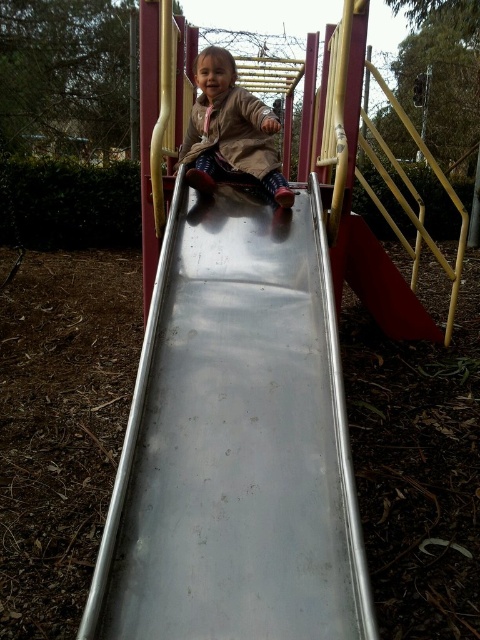
Who is taller, metallic smooth slide at center or matte brown coat at center?

metallic smooth slide at center

Who is more forward, (228,545) or (223,124)?

Point (228,545) is in front.

You are a GUI agent. You are given a task and a screenshot of the screen. Output one action in this format:
    pyautogui.click(x=<x>, y=<y>)
    Task: Click on the metallic smooth slide at center
    This screenshot has height=640, width=480.
    Given the screenshot: What is the action you would take?
    pyautogui.click(x=235, y=444)